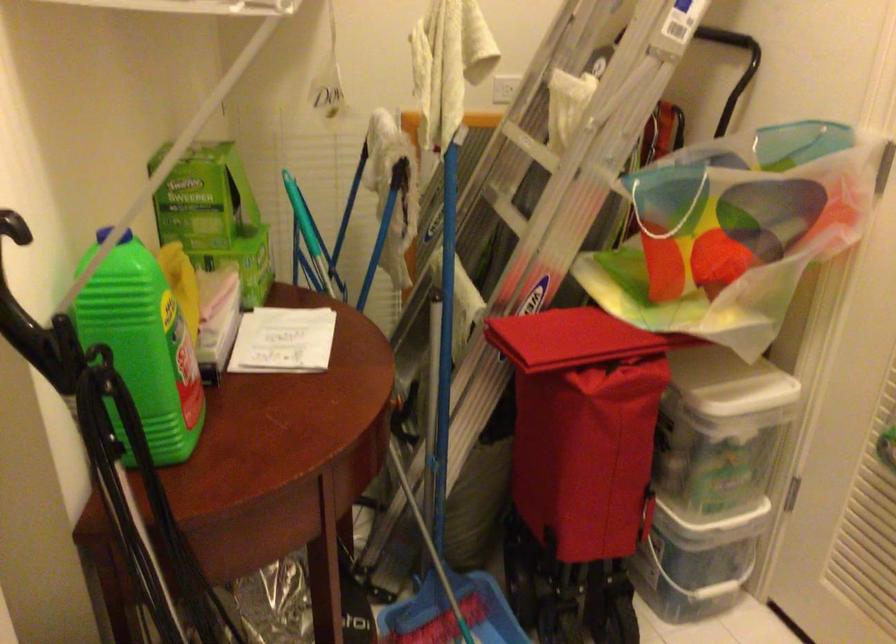
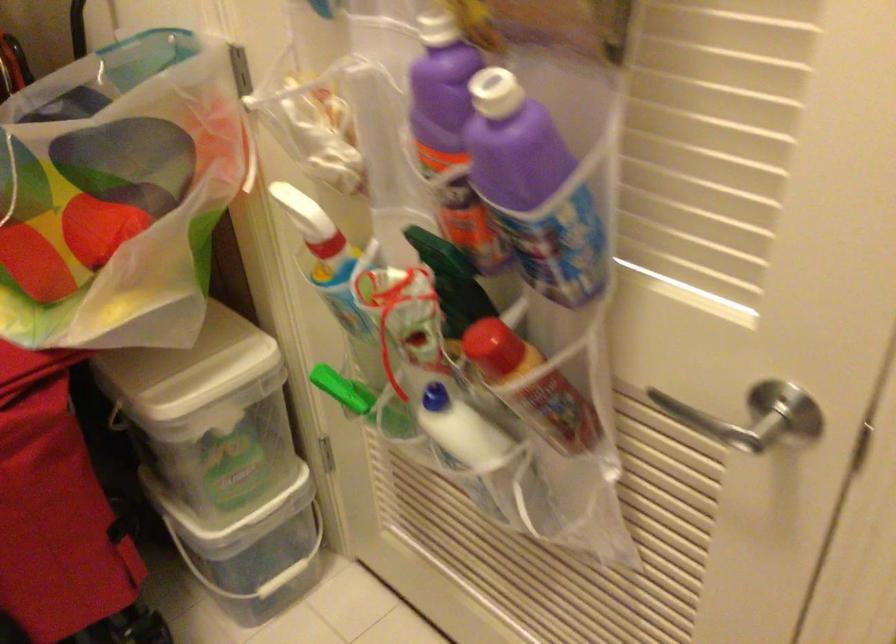
The images are taken continuously from a first-person perspective. In which direction are you moving?

The cameraman walked toward right, forward.